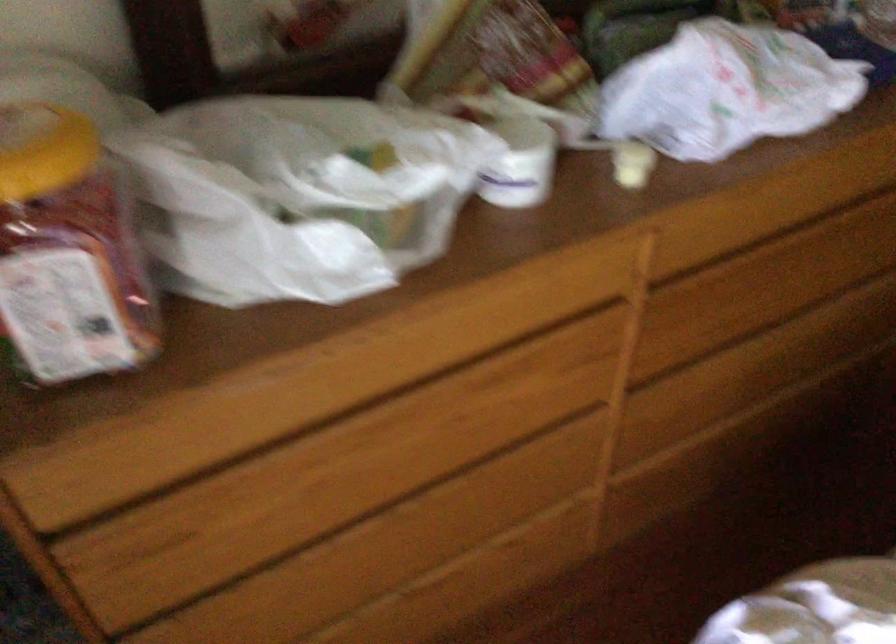
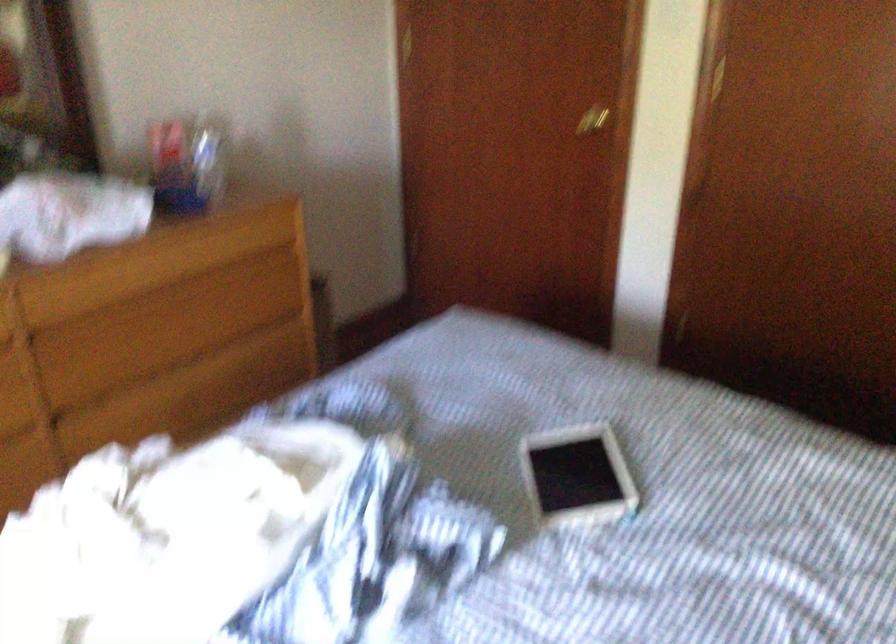
In a continuous first-person perspective shot, in which direction is the camera moving?

The cameraman walked toward right, backward.